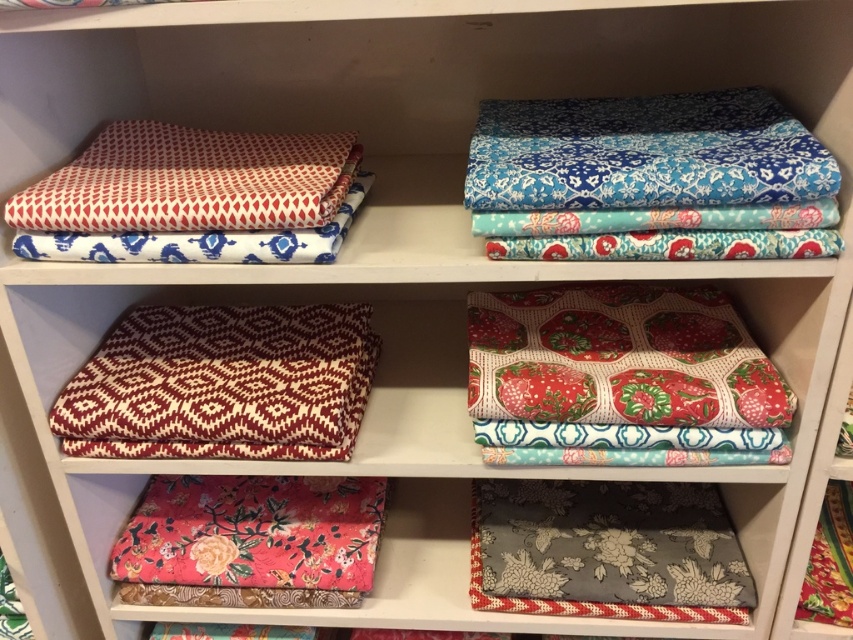
What do you see at coordinates (606, 550) in the screenshot? I see `gray floral fabric at lower right` at bounding box center [606, 550].

Is point (701, 518) farther from camera compared to point (112, 196)?

Yes, it is.

Find the location of `gray floral fabric at lower right`. gray floral fabric at lower right is located at coordinates (606, 550).

Between point (370, 342) and point (285, 156), which one is positioned behind?

Positioned behind is point (370, 342).

What do you see at coordinates (222, 385) in the screenshot? The image size is (853, 640). I see `maroon and cream geometric fabric at center` at bounding box center [222, 385].

Is point (236, 376) positioned in front of point (241, 163)?

No, (236, 376) is behind (241, 163).

At what (x,y) coordinates should I click in order to perform the action: click on maroon and cream geometric fabric at center. Please return your answer as a coordinate pair (x, y). Looking at the image, I should click on (222, 385).

Does floral fabric at lower left have a lesser height compared to matte white fabric at upper left?

Yes, floral fabric at lower left is shorter than matte white fabric at upper left.

Is point (184, 480) positioned in front of point (254, 156)?

No.

Is point (339, 566) closer to camera compared to point (160, 198)?

No, it is behind (160, 198).

Where is `floral fabric at lower left`? This screenshot has height=640, width=853. floral fabric at lower left is located at coordinates (250, 541).